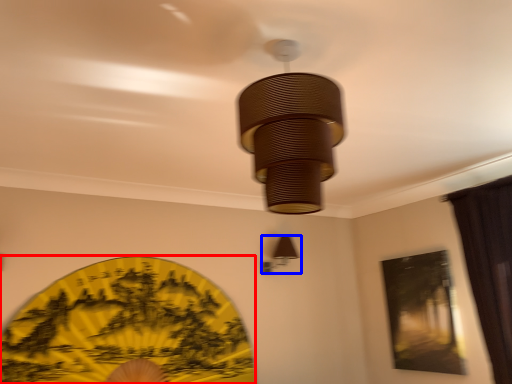
Question: Which of the following is the farthest to the observer, design (highlighted by a red box) or lamp (highlighted by a blue box)?

Choices:
 (A) design
 (B) lamp

Answer: (B)